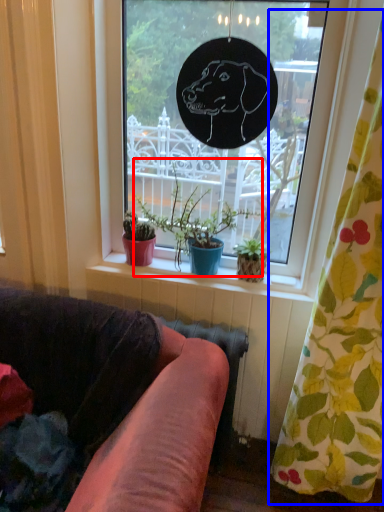
Question: Which object appears closest to the camera in this image, houseplant (highlighted by a red box) or curtain (highlighted by a blue box)?

Choices:
 (A) houseplant
 (B) curtain

Answer: (B)